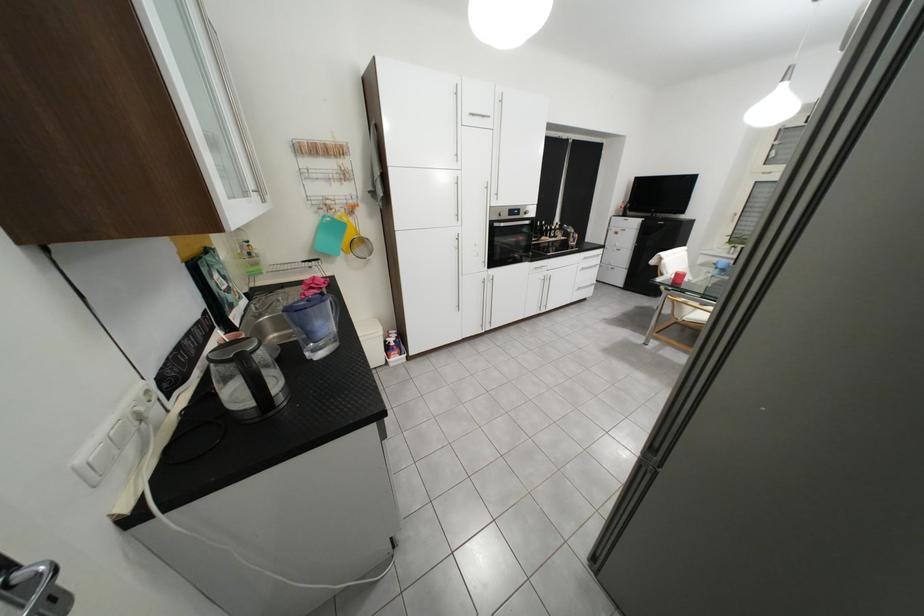
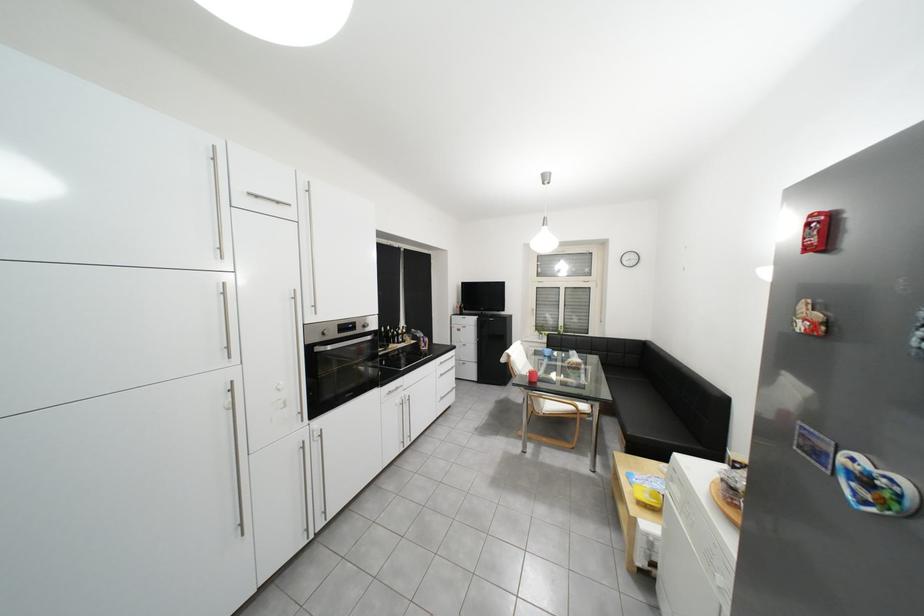
In the second image, find the point that corresponds to (512,216) in the first image.

(334, 334)